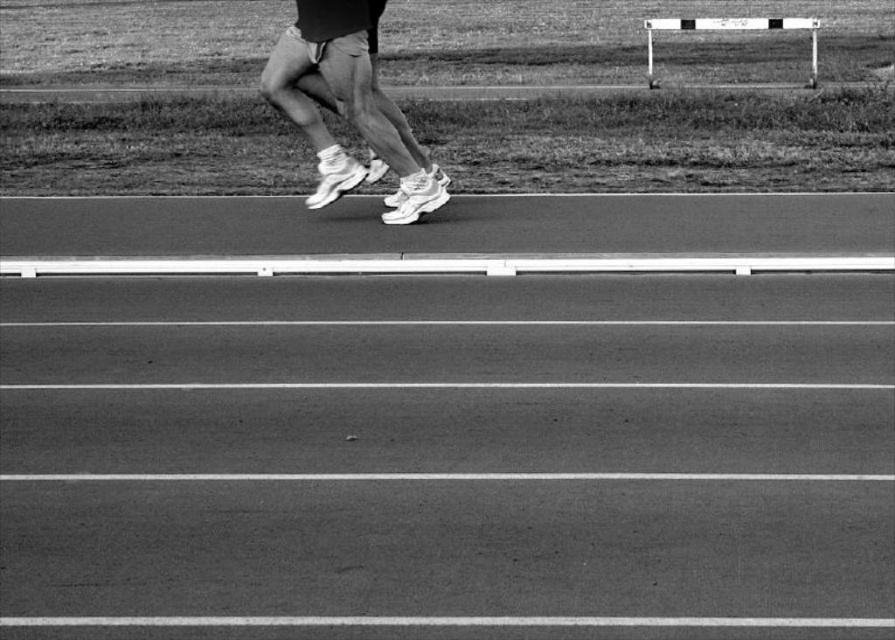
You are an athlete preparing for a race. You see the smooth asphalt track at center and the metallic silver hurdle at upper right. Which object is closer to you?

The smooth asphalt track at center is closer to you because it is shorter than the metallic silver hurdle at upper right.

In the scene shown: You are a photographer setting up a camera to capture the runner on the smooth asphalt track at center. The camera is placed at the origin point. Where should you aim the camera to ensure the runner is centered in the frame?

The smooth asphalt track at center is located at point (x=448, y=417), so the camera should be aimed at those coordinates to center the runner on the track.